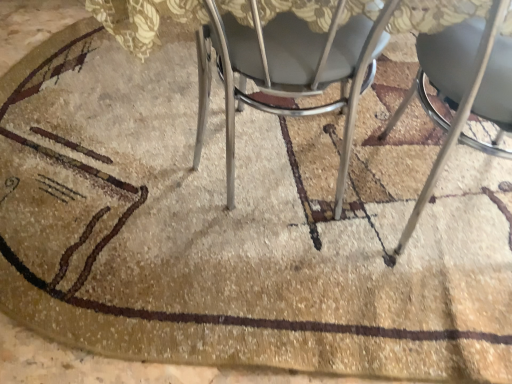
The height and width of the screenshot is (384, 512). Describe the element at coordinates (456, 121) in the screenshot. I see `metallic silver chair at lower right, acting as the 2th chair starting from the left` at that location.

Where is `metallic silver chair at lower right, placed as the first chair when sorted from right to left`? This screenshot has width=512, height=384. metallic silver chair at lower right, placed as the first chair when sorted from right to left is located at coordinates (456, 121).

How much space does metallic silver chair at lower right, placed as the first chair when sorted from right to left, occupy horizontally?

metallic silver chair at lower right, placed as the first chair when sorted from right to left, is 39.35 centimeters wide.

What do you see at coordinates (288, 70) in the screenshot? I see `metallic silver chair at center, the second chair from the right` at bounding box center [288, 70].

At what (x,y) coordinates should I click in order to perform the action: click on metallic silver chair at center, the second chair from the right. Please return your answer as a coordinate pair (x, y). Looking at the image, I should click on (288, 70).

Find the location of a particular element. The height and width of the screenshot is (384, 512). metallic silver chair at lower right, placed as the first chair when sorted from right to left is located at coordinates (456, 121).

Is metallic silver chair at lower right, placed as the first chair when sorted from right to left, to the left of metallic silver chair at center, placed as the first chair when sorted from left to right, from the viewer's perspective?

Incorrect, metallic silver chair at lower right, placed as the first chair when sorted from right to left, is not on the left side of metallic silver chair at center, placed as the first chair when sorted from left to right.

Is metallic silver chair at lower right, placed as the first chair when sorted from right to left, in front of or behind metallic silver chair at center, placed as the first chair when sorted from left to right, in the image?

In the image, metallic silver chair at lower right, placed as the first chair when sorted from right to left, appears in front of metallic silver chair at center, placed as the first chair when sorted from left to right.

Which is less distant, (x=397, y=253) or (x=238, y=28)?

The point (x=238, y=28) is closer to the camera.

From the image's perspective, is metallic silver chair at lower right, placed as the first chair when sorted from right to left, positioned above or below metallic silver chair at center, placed as the first chair when sorted from left to right?

From the image's perspective, metallic silver chair at lower right, placed as the first chair when sorted from right to left, appears below metallic silver chair at center, placed as the first chair when sorted from left to right.

From a real-world perspective, is metallic silver chair at lower right, acting as the 2th chair starting from the left, on top of metallic silver chair at center, placed as the first chair when sorted from left to right?

Correct, in the physical world, metallic silver chair at lower right, acting as the 2th chair starting from the left, is higher than metallic silver chair at center, placed as the first chair when sorted from left to right.

Can you confirm if metallic silver chair at lower right, placed as the first chair when sorted from right to left, is thinner than metallic silver chair at center, the second chair from the right?

Correct, the width of metallic silver chair at lower right, placed as the first chair when sorted from right to left, is less than that of metallic silver chair at center, the second chair from the right.

Considering the sizes of objects metallic silver chair at lower right, acting as the 2th chair starting from the left, and metallic silver chair at center, placed as the first chair when sorted from left to right, in the image provided, who is taller, metallic silver chair at lower right, acting as the 2th chair starting from the left, or metallic silver chair at center, placed as the first chair when sorted from left to right,?

With more height is metallic silver chair at lower right, acting as the 2th chair starting from the left.

Considering the sizes of objects metallic silver chair at lower right, placed as the first chair when sorted from right to left, and metallic silver chair at center, placed as the first chair when sorted from left to right, in the image provided, who is bigger, metallic silver chair at lower right, placed as the first chair when sorted from right to left, or metallic silver chair at center, placed as the first chair when sorted from left to right,?

With larger size is metallic silver chair at center, placed as the first chair when sorted from left to right.

Is metallic silver chair at lower right, acting as the 2th chair starting from the left, situated inside metallic silver chair at center, placed as the first chair when sorted from left to right, or outside?

metallic silver chair at lower right, acting as the 2th chair starting from the left, lies outside metallic silver chair at center, placed as the first chair when sorted from left to right.

Would you consider metallic silver chair at lower right, placed as the first chair when sorted from right to left, to be distant from metallic silver chair at center, placed as the first chair when sorted from left to right?

No, metallic silver chair at lower right, placed as the first chair when sorted from right to left, is not far from metallic silver chair at center, placed as the first chair when sorted from left to right.

From the picture: Could you tell me if metallic silver chair at lower right, placed as the first chair when sorted from right to left, is facing metallic silver chair at center, placed as the first chair when sorted from left to right?

No, metallic silver chair at lower right, placed as the first chair when sorted from right to left, is not turned towards metallic silver chair at center, placed as the first chair when sorted from left to right.

The height and width of the screenshot is (384, 512). I want to click on chair lying above the metallic silver chair at lower right, acting as the 2th chair starting from the left (from the image's perspective), so (x=288, y=70).

Based on their positions, is metallic silver chair at center, the second chair from the right, located to the left or right of metallic silver chair at lower right, acting as the 2th chair starting from the left?

metallic silver chair at center, the second chair from the right, is positioned on metallic silver chair at lower right, acting as the 2th chair starting from the left,'s left side.

Which object is further away from the camera taking this photo, metallic silver chair at center, placed as the first chair when sorted from left to right, or metallic silver chair at lower right, acting as the 2th chair starting from the left?

metallic silver chair at center, placed as the first chair when sorted from left to right, is further from the camera.

Is point (208, 96) closer or farther from the camera than point (472, 92)?

Point (208, 96) appears to be farther away from the viewer than point (472, 92).

From the image's perspective, which is above, metallic silver chair at center, placed as the first chair when sorted from left to right, or metallic silver chair at lower right, acting as the 2th chair starting from the left?

metallic silver chair at center, placed as the first chair when sorted from left to right, appears higher in the image.

From a real-world perspective, is metallic silver chair at center, placed as the first chair when sorted from left to right, above or below metallic silver chair at lower right, acting as the 2th chair starting from the left?

In terms of real-world spatial position, metallic silver chair at center, placed as the first chair when sorted from left to right, is below metallic silver chair at lower right, acting as the 2th chair starting from the left.

Looking at their sizes, would you say metallic silver chair at center, the second chair from the right, is wider or thinner than metallic silver chair at lower right, acting as the 2th chair starting from the left?

metallic silver chair at center, the second chair from the right, is wider than metallic silver chair at lower right, acting as the 2th chair starting from the left.

Is metallic silver chair at center, placed as the first chair when sorted from left to right, taller or shorter than metallic silver chair at lower right, placed as the first chair when sorted from right to left?

Clearly, metallic silver chair at center, placed as the first chair when sorted from left to right, is shorter compared to metallic silver chair at lower right, placed as the first chair when sorted from right to left.

Is metallic silver chair at center, the second chair from the right, bigger or smaller than metallic silver chair at lower right, placed as the first chair when sorted from right to left?

Considering their sizes, metallic silver chair at center, the second chair from the right, takes up more space than metallic silver chair at lower right, placed as the first chair when sorted from right to left.

Do you think metallic silver chair at center, placed as the first chair when sorted from left to right, is within metallic silver chair at lower right, placed as the first chair when sorted from right to left, or outside of it?

metallic silver chair at center, placed as the first chair when sorted from left to right, is outside metallic silver chair at lower right, placed as the first chair when sorted from right to left.

Is metallic silver chair at center, placed as the first chair when sorted from left to right, positioned far away from metallic silver chair at lower right, placed as the first chair when sorted from right to left?

No, metallic silver chair at center, placed as the first chair when sorted from left to right, is in close proximity to metallic silver chair at lower right, placed as the first chair when sorted from right to left.

Is metallic silver chair at center, placed as the first chair when sorted from left to right, oriented away from metallic silver chair at lower right, acting as the 2th chair starting from the left?

No, metallic silver chair at center, placed as the first chair when sorted from left to right, is not facing the opposite direction of metallic silver chair at lower right, acting as the 2th chair starting from the left.

How many degrees apart are the facing directions of metallic silver chair at center, the second chair from the right, and metallic silver chair at lower right, acting as the 2th chair starting from the left?

metallic silver chair at center, the second chair from the right, and metallic silver chair at lower right, acting as the 2th chair starting from the left, are facing 0.000161 degrees away from each other.

Measure the distance from metallic silver chair at center, the second chair from the right, to metallic silver chair at lower right, acting as the 2th chair starting from the left.

They are 13.14 inches apart.

At what (x,y) coordinates should I click in order to perform the action: click on chair that is under the metallic silver chair at lower right, placed as the first chair when sorted from right to left (from a real-world perspective). Please return your answer as a coordinate pair (x, y). Image resolution: width=512 pixels, height=384 pixels. Looking at the image, I should click on (288, 70).

Where is `chair behind the metallic silver chair at lower right, placed as the first chair when sorted from right to left`? chair behind the metallic silver chair at lower right, placed as the first chair when sorted from right to left is located at coordinates (288, 70).

Find the location of `chair in front of the metallic silver chair at center, placed as the first chair when sorted from left to right`. chair in front of the metallic silver chair at center, placed as the first chair when sorted from left to right is located at coordinates (456, 121).